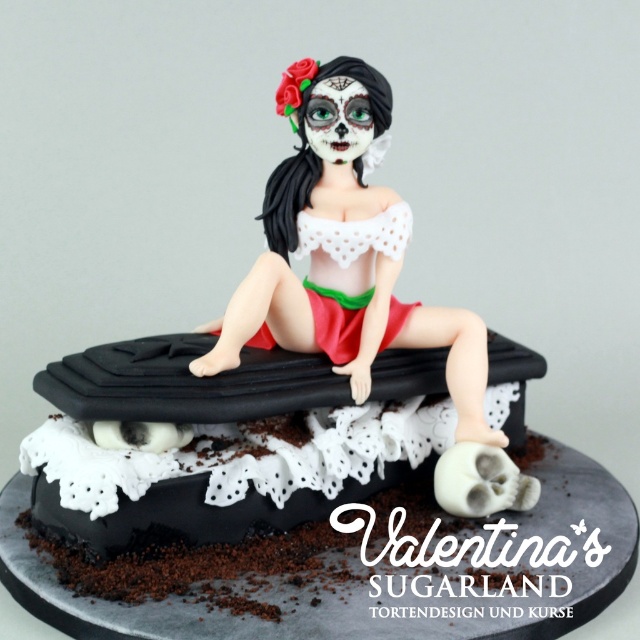
Question: Which point is closer to the camera?

Choices:
 (A) (310, 88)
 (B) (196, 476)

Answer: (B)

Question: Among these objects, which one is nearest to the camera?

Choices:
 (A) matte white sugar figure at center
 (B) black glossy chocolate cake at center

Answer: (B)

Question: Is black glossy chocolate cake at center wider than matte white sugar figure at center?

Choices:
 (A) yes
 (B) no

Answer: (A)

Question: Does black glossy chocolate cake at center have a larger size compared to matte white sugar figure at center?

Choices:
 (A) yes
 (B) no

Answer: (A)

Question: Is black glossy chocolate cake at center above matte white sugar figure at center?

Choices:
 (A) yes
 (B) no

Answer: (B)